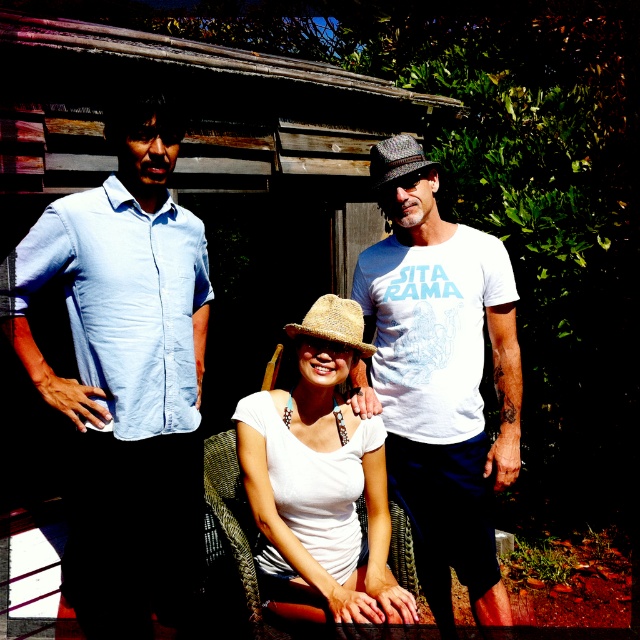
From the picture: Based on the scene, which object is taller between the light blue cotton shirt at left and the shiny metallic cowboy hat at center?

The light blue cotton shirt at left is taller than the shiny metallic cowboy hat at center.